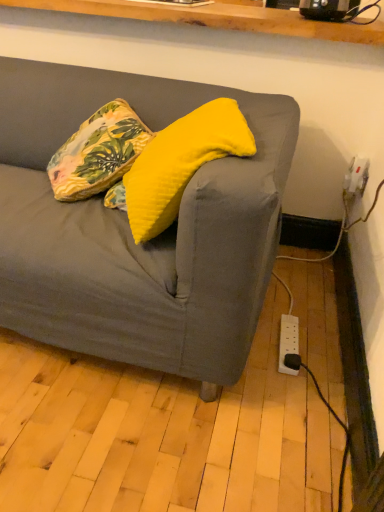
Locate an element on the screen. yellow soft cushion at center, which appears as the second pillow when viewed from the left is located at coordinates (181, 163).

The image size is (384, 512). Describe the element at coordinates (181, 163) in the screenshot. I see `yellow soft cushion at center, which appears as the second pillow when viewed from the left` at that location.

Describe the element at coordinates (98, 152) in the screenshot. I see `floral fabric pillow at upper left, which is counted as the first pillow, starting from the left` at that location.

You are a GUI agent. You are given a task and a screenshot of the screen. Output one action in this format:
    pyautogui.click(x=<x>, y=<y>)
    Task: Click on the floral fabric pillow at upper left, the 2th pillow from the right
    Image resolution: width=384 pixels, height=512 pixels.
    Given the screenshot: What is the action you would take?
    pyautogui.click(x=98, y=152)

This screenshot has height=512, width=384. In order to click on yellow soft cushion at center, which appears as the second pillow when viewed from the left in this screenshot , I will do `click(181, 163)`.

In the scene shown: Would you say floral fabric pillow at upper left, which is counted as the first pillow, starting from the left, is to the left or to the right of yellow soft cushion at center, which is the first pillow in right-to-left order, in the picture?

Based on their positions, floral fabric pillow at upper left, which is counted as the first pillow, starting from the left, is located to the left of yellow soft cushion at center, which is the first pillow in right-to-left order.

Is the position of floral fabric pillow at upper left, which is counted as the first pillow, starting from the left, more distant than that of yellow soft cushion at center, which is the first pillow in right-to-left order?

Yes, floral fabric pillow at upper left, which is counted as the first pillow, starting from the left, is further from the camera.

Considering the positions of point (103, 170) and point (179, 177), is point (103, 170) closer or farther from the camera than point (179, 177)?

Point (103, 170) appears to be farther away from the viewer than point (179, 177).

From the image's perspective, is floral fabric pillow at upper left, the 2th pillow from the right, under yellow soft cushion at center, which is the first pillow in right-to-left order?

No, from the image's perspective, floral fabric pillow at upper left, the 2th pillow from the right, is not below yellow soft cushion at center, which is the first pillow in right-to-left order.

From a real-world perspective, relative to yellow soft cushion at center, which is the first pillow in right-to-left order, is floral fabric pillow at upper left, the 2th pillow from the right, vertically above or below?

Clearly, from a real-world perspective, floral fabric pillow at upper left, the 2th pillow from the right, is below yellow soft cushion at center, which is the first pillow in right-to-left order.

Looking at their sizes, would you say floral fabric pillow at upper left, which is counted as the first pillow, starting from the left, is wider or thinner than yellow soft cushion at center, which appears as the second pillow when viewed from the left?

Clearly, floral fabric pillow at upper left, which is counted as the first pillow, starting from the left, has more width compared to yellow soft cushion at center, which appears as the second pillow when viewed from the left.

Between floral fabric pillow at upper left, which is counted as the first pillow, starting from the left, and yellow soft cushion at center, which appears as the second pillow when viewed from the left, which one has less height?

With less height is floral fabric pillow at upper left, which is counted as the first pillow, starting from the left.

Looking at this image, considering the relative sizes of floral fabric pillow at upper left, which is counted as the first pillow, starting from the left, and yellow soft cushion at center, which is the first pillow in right-to-left order, in the image provided, is floral fabric pillow at upper left, which is counted as the first pillow, starting from the left, bigger than yellow soft cushion at center, which is the first pillow in right-to-left order,?

Incorrect, floral fabric pillow at upper left, which is counted as the first pillow, starting from the left, is not larger than yellow soft cushion at center, which is the first pillow in right-to-left order.

Is floral fabric pillow at upper left, the 2th pillow from the right, completely or partially outside of yellow soft cushion at center, which is the first pillow in right-to-left order?

Yes, floral fabric pillow at upper left, the 2th pillow from the right, is outside of yellow soft cushion at center, which is the first pillow in right-to-left order.

From the picture: Can you see floral fabric pillow at upper left, the 2th pillow from the right, touching yellow soft cushion at center, which appears as the second pillow when viewed from the left?

No, floral fabric pillow at upper left, the 2th pillow from the right, is not touching yellow soft cushion at center, which appears as the second pillow when viewed from the left.

Is floral fabric pillow at upper left, which is counted as the first pillow, starting from the left, oriented towards yellow soft cushion at center, which is the first pillow in right-to-left order?

No, floral fabric pillow at upper left, which is counted as the first pillow, starting from the left, is not turned towards yellow soft cushion at center, which is the first pillow in right-to-left order.

Measure the distance from floral fabric pillow at upper left, which is counted as the first pillow, starting from the left, to yellow soft cushion at center, which is the first pillow in right-to-left order.

floral fabric pillow at upper left, which is counted as the first pillow, starting from the left, is 9.66 inches away from yellow soft cushion at center, which is the first pillow in right-to-left order.

Find the location of `pillow that is behind the yellow soft cushion at center, which appears as the second pillow when viewed from the left`. pillow that is behind the yellow soft cushion at center, which appears as the second pillow when viewed from the left is located at coordinates (98, 152).

Visually, is yellow soft cushion at center, which appears as the second pillow when viewed from the left, positioned to the left or to the right of floral fabric pillow at upper left, which is counted as the first pillow, starting from the left?

yellow soft cushion at center, which appears as the second pillow when viewed from the left, is to the right of floral fabric pillow at upper left, which is counted as the first pillow, starting from the left.

Is yellow soft cushion at center, which is the first pillow in right-to-left order, positioned in front of floral fabric pillow at upper left, which is counted as the first pillow, starting from the left?

That is True.

Which is in front, point (134, 229) or point (98, 191)?

Point (134, 229)

From the image's perspective, would you say yellow soft cushion at center, which appears as the second pillow when viewed from the left, is shown under floral fabric pillow at upper left, which is counted as the first pillow, starting from the left?

Yes, from the image's perspective, yellow soft cushion at center, which appears as the second pillow when viewed from the left, is below floral fabric pillow at upper left, which is counted as the first pillow, starting from the left.

From a real-world perspective, does yellow soft cushion at center, which is the first pillow in right-to-left order, sit lower than floral fabric pillow at upper left, the 2th pillow from the right?

No, from a real-world perspective, yellow soft cushion at center, which is the first pillow in right-to-left order, is not under floral fabric pillow at upper left, the 2th pillow from the right.

Considering the relative sizes of yellow soft cushion at center, which is the first pillow in right-to-left order, and floral fabric pillow at upper left, the 2th pillow from the right, in the image provided, is yellow soft cushion at center, which is the first pillow in right-to-left order, wider than floral fabric pillow at upper left, the 2th pillow from the right,?

Incorrect, the width of yellow soft cushion at center, which is the first pillow in right-to-left order, does not surpass that of floral fabric pillow at upper left, the 2th pillow from the right.

Which of these two, yellow soft cushion at center, which appears as the second pillow when viewed from the left, or floral fabric pillow at upper left, the 2th pillow from the right, stands shorter?

floral fabric pillow at upper left, the 2th pillow from the right.

Considering the relative sizes of yellow soft cushion at center, which appears as the second pillow when viewed from the left, and floral fabric pillow at upper left, which is counted as the first pillow, starting from the left, in the image provided, is yellow soft cushion at center, which appears as the second pillow when viewed from the left, smaller than floral fabric pillow at upper left, which is counted as the first pillow, starting from the left,?

Actually, yellow soft cushion at center, which appears as the second pillow when viewed from the left, might be larger than floral fabric pillow at upper left, which is counted as the first pillow, starting from the left.

Do you think yellow soft cushion at center, which is the first pillow in right-to-left order, is within floral fabric pillow at upper left, which is counted as the first pillow, starting from the left, or outside of it?

yellow soft cushion at center, which is the first pillow in right-to-left order, is located beyond the bounds of floral fabric pillow at upper left, which is counted as the first pillow, starting from the left.

Is yellow soft cushion at center, which appears as the second pillow when viewed from the left, in contact with floral fabric pillow at upper left, which is counted as the first pillow, starting from the left?

No, yellow soft cushion at center, which appears as the second pillow when viewed from the left, is not with floral fabric pillow at upper left, which is counted as the first pillow, starting from the left.

Looking at this image, is yellow soft cushion at center, which is the first pillow in right-to-left order, facing towards floral fabric pillow at upper left, which is counted as the first pillow, starting from the left?

No, yellow soft cushion at center, which is the first pillow in right-to-left order, is not turned towards floral fabric pillow at upper left, which is counted as the first pillow, starting from the left.

This screenshot has width=384, height=512. Find the location of `pillow that is on the left side of yellow soft cushion at center, which appears as the second pillow when viewed from the left`. pillow that is on the left side of yellow soft cushion at center, which appears as the second pillow when viewed from the left is located at coordinates (98, 152).

Locate an element on the screen. This screenshot has height=512, width=384. pillow below the floral fabric pillow at upper left, the 2th pillow from the right (from the image's perspective) is located at coordinates (181, 163).

Where is `pillow above the floral fabric pillow at upper left, the 2th pillow from the right (from a real-world perspective)`? Image resolution: width=384 pixels, height=512 pixels. pillow above the floral fabric pillow at upper left, the 2th pillow from the right (from a real-world perspective) is located at coordinates (181, 163).